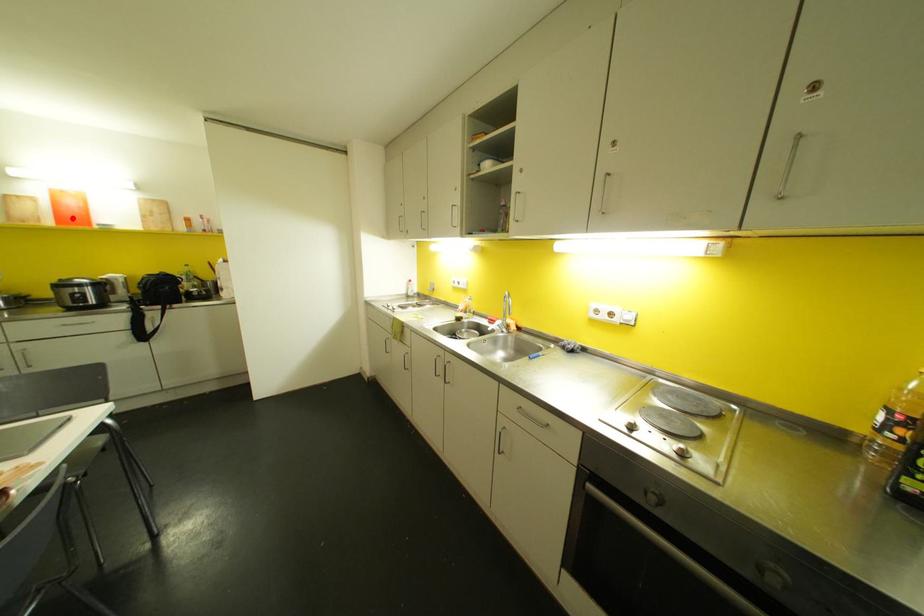
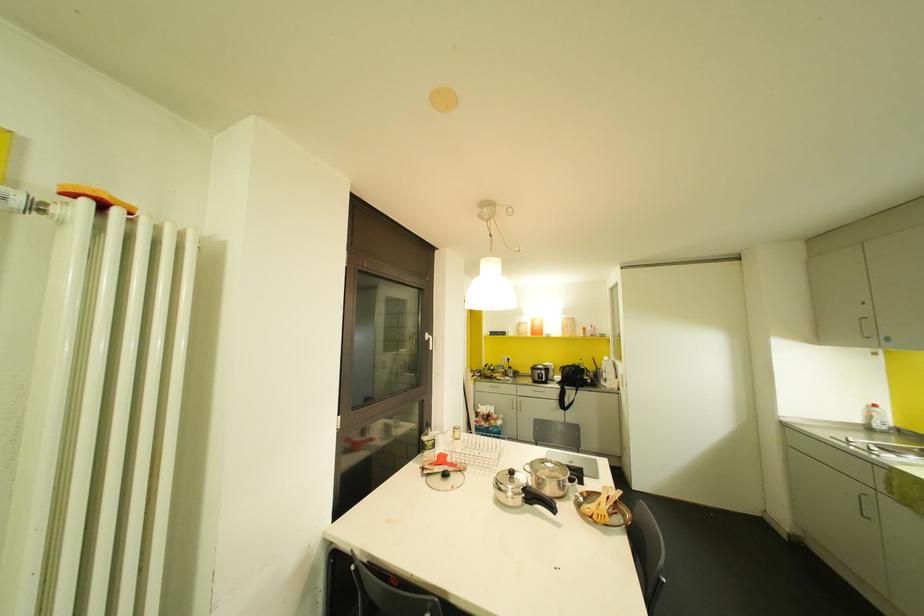
The point at the highlighted location is marked in the first image. Where is the corresponding point in the second image?

(536, 331)